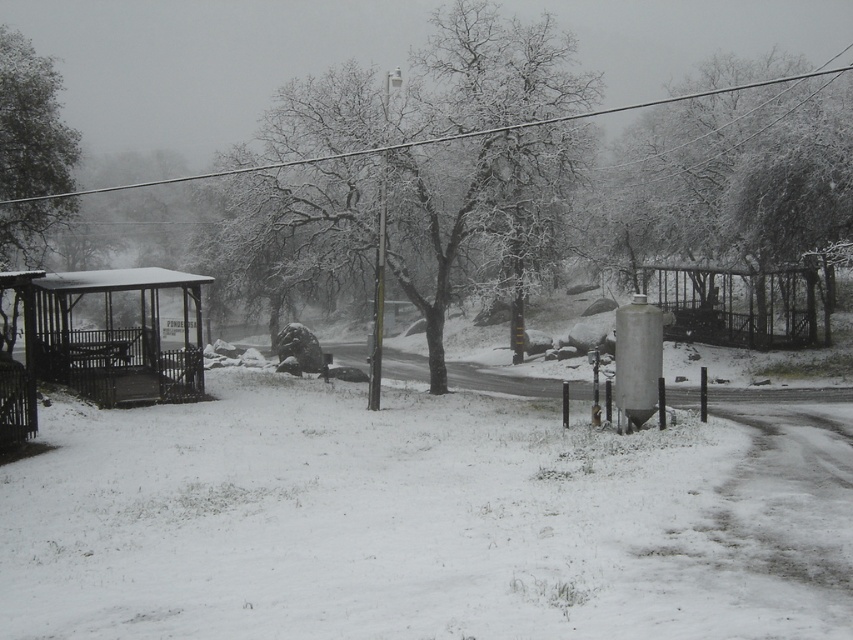
Question: Does snow-covered tree at upper right appear on the left side of metallic wire at upper center?

Choices:
 (A) yes
 (B) no

Answer: (B)

Question: Can you confirm if snow-covered tree at center is positioned above snow-covered tree at upper right?

Choices:
 (A) no
 (B) yes

Answer: (B)

Question: Among these points, which one is nearest to the camera?

Choices:
 (A) (503, 145)
 (B) (689, 188)
 (C) (108, 320)

Answer: (A)

Question: Which object is positioned closest to the snow-covered tree at center?

Choices:
 (A) metallic silver bus stop at left
 (B) snow-covered tree at upper right
 (C) metallic wire at upper center

Answer: (C)

Question: Does snow-covered tree at upper right have a lesser width compared to snow-covered tree at left?

Choices:
 (A) yes
 (B) no

Answer: (A)

Question: Considering the real-world distances, which object is farthest from the snow-covered tree at upper right?

Choices:
 (A) metallic wire at upper center
 (B) snow-covered tree at left

Answer: (B)